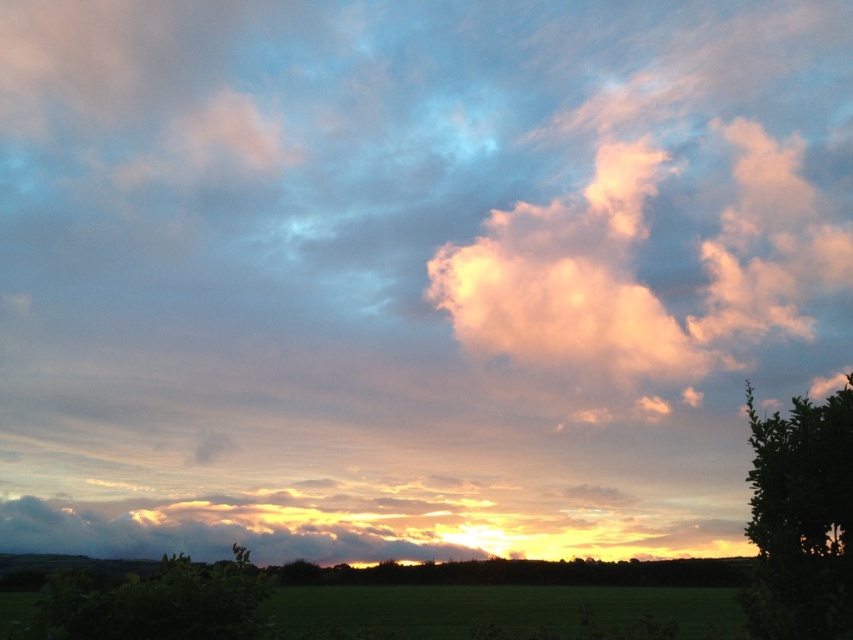
You are a gardener who needs to place a 15 feet long fence between the green leafy tree at right and the green leafy bush at lower left. Can the fence fit between them without bending?

The distance between the green leafy tree at right and the green leafy bush at lower left is 14.21 feet. Since the fence is 15 feet long, it is longer than the space available. Therefore, the fence cannot fit between them without bending.

Based on the photo, you are standing in the landscape scene and want to place a small statue between the green leafy tree at right and the green leafy bush at lower left. Based on their positions, where should you place the statue so it is equidistant from both?

Since the green leafy tree at right is located above the green leafy bush at lower left, you should place the statue somewhere in the middle between them vertically. This will ensure it is equidistant from both the tree and the bush.

You are standing in the landscape scene and want to take a photo of the green leafy tree at right. If your camera has a maximum focus range of 5 meters, will you need to move closer to the tree to capture it clearly?

The green leafy tree at right is 5.79 meters away from the camera. Since the camera can only focus up to 5 meters, you need to move closer to the tree to ensure it is in focus.